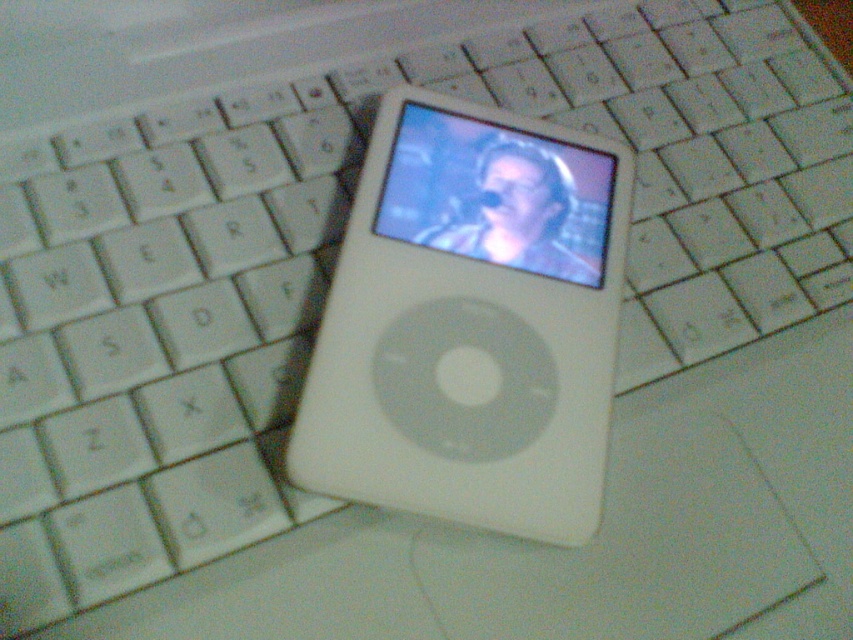
Question: Among these objects, which one is nearest to the camera?

Choices:
 (A) matte plastic screen at center
 (B) white plastic ipod at center

Answer: (B)

Question: Is white plastic ipod at center to the left of matte plastic screen at center from the viewer's perspective?

Choices:
 (A) no
 (B) yes

Answer: (B)

Question: Which point appears closest to the camera in this image?

Choices:
 (A) (498, 200)
 (B) (364, 195)

Answer: (B)

Question: Is white plastic ipod at center closer to camera compared to matte plastic screen at center?

Choices:
 (A) yes
 (B) no

Answer: (A)

Question: Is white plastic ipod at center further to camera compared to matte plastic screen at center?

Choices:
 (A) yes
 (B) no

Answer: (B)

Question: Which of the following is the closest to the observer?

Choices:
 (A) (438, 172)
 (B) (393, 460)

Answer: (B)